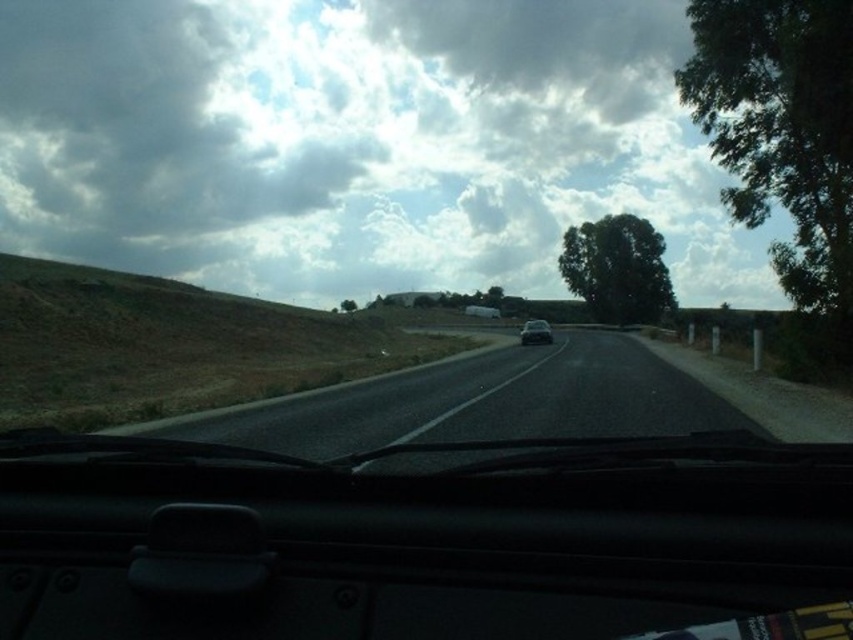
Question: Does transparent glass windshield at center appear under black asphalt road at center?

Choices:
 (A) no
 (B) yes

Answer: (B)

Question: Which object is closer to the camera taking this photo?

Choices:
 (A) cloudy sky at upper center
 (B) black asphalt road at center
 (C) green leafy tree at upper center
 (D) sleek silver sedan at center

Answer: (B)

Question: Can you confirm if cloudy sky at upper center is smaller than green leafy tree at center?

Choices:
 (A) yes
 (B) no

Answer: (B)

Question: Estimate the real-world distances between objects in this image. Which object is farther from the sleek silver sedan at center?

Choices:
 (A) transparent glass windshield at center
 (B) black asphalt road at center
 (C) green leafy tree at center
 (D) green leafy tree at right

Answer: (C)

Question: Considering the real-world distances, which object is farthest from the green leafy tree at right?

Choices:
 (A) sleek silver sedan at center
 (B) green leafy tree at center
 (C) black asphalt road at center

Answer: (B)

Question: Does green leafy tree at center have a lesser width compared to green leafy tree at upper center?

Choices:
 (A) yes
 (B) no

Answer: (B)